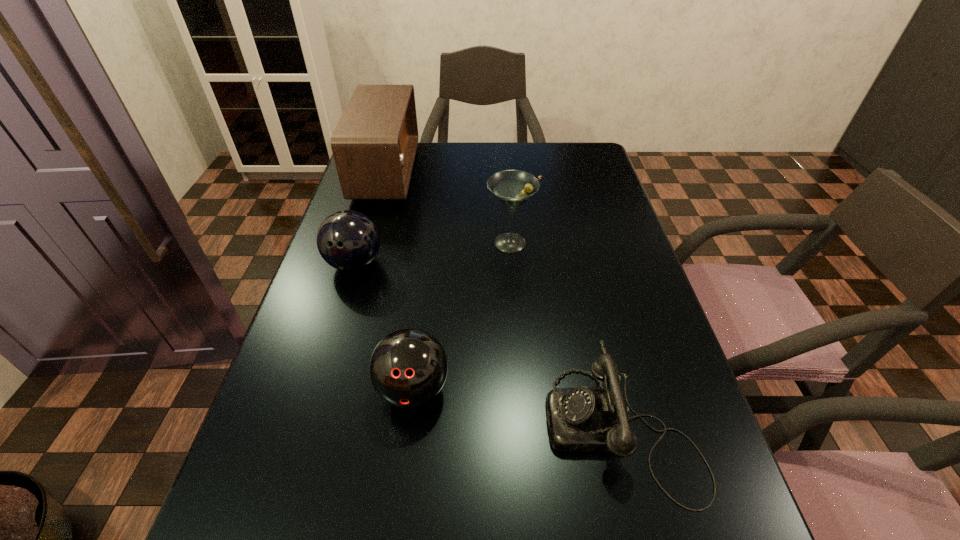
You are a GUI agent. You are given a task and a screenshot of the screen. Output one action in this format:
    pyautogui.click(x=<x>, y=<y>)
    Task: Click on the empty location between the farther bowling ball and the radio receiver
    The image size is (960, 540).
    Given the screenshot: What is the action you would take?
    [x=371, y=218]

Where is `the closest object relative to the farthest object`? This screenshot has height=540, width=960. the closest object relative to the farthest object is located at coordinates (347, 240).

Locate which object ranks fourth in proximity to the farther bowling ball. Please provide its 2D coordinates. Your answer should be formatted as a tuple, i.e. [(x, y)], where the tuple contains the x and y coordinates of a point satisfying the conditions above.

[(580, 419)]

This screenshot has height=540, width=960. In order to click on free region that satisfies the following two spatial constraints: 1. on the front-facing side of the martini; 2. on the left side of the radio receiver in this screenshot , I will do pyautogui.click(x=366, y=243).